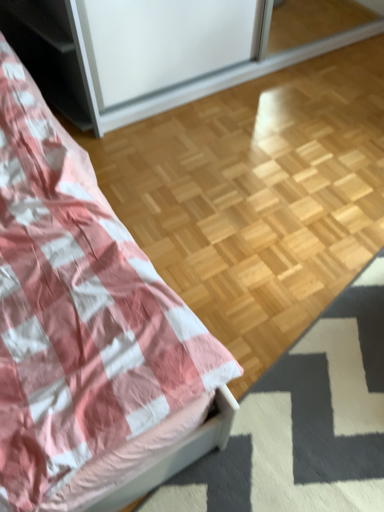
Measure the distance between point (11, 265) and camera.

The depth of point (11, 265) is 38.82 inches.

What do you see at coordinates (81, 320) in the screenshot?
I see `pink cotton bed at left` at bounding box center [81, 320].

In order to face pink cotton bed at left, should I rotate leftwards or rightwards?

Rotate left and turn 26.917 degrees.

This screenshot has width=384, height=512. In order to click on pink cotton bed at left in this screenshot , I will do `click(81, 320)`.

Find the location of a particular element. This screenshot has width=384, height=512. pink cotton bed at left is located at coordinates (81, 320).